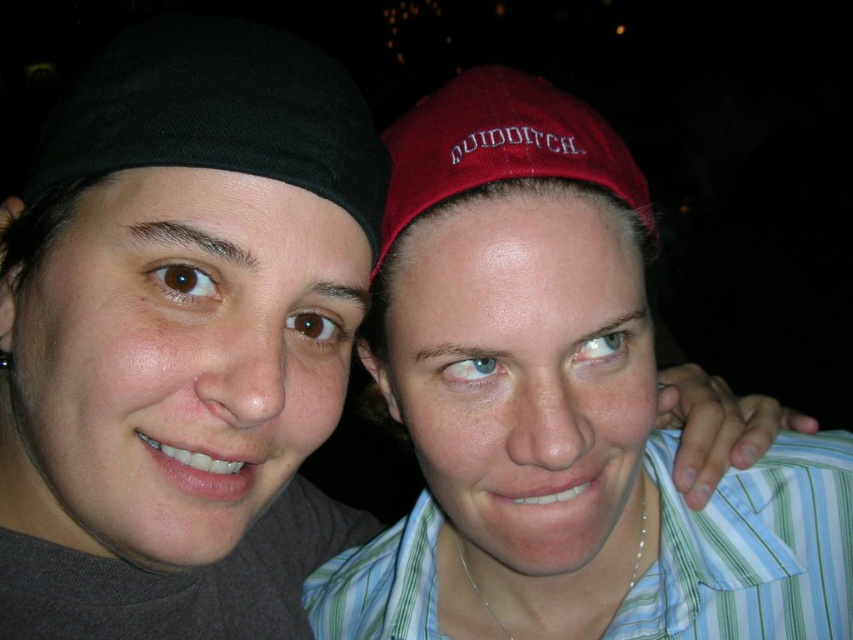
Question: Which point is closer to the camera?

Choices:
 (A) matte red cap at upper right
 (B) black fabric headband at left

Answer: (B)

Question: Which point is farther from the camera taking this photo?

Choices:
 (A) (317, 147)
 (B) (468, 365)
 (C) (556, 150)

Answer: (B)

Question: Is black fabric headband at left bigger than burgundy fabric cap at upper center?

Choices:
 (A) yes
 (B) no

Answer: (A)

Question: Can you confirm if matte red cap at upper right is thinner than black fabric headband at left?

Choices:
 (A) yes
 (B) no

Answer: (B)

Question: Does matte red cap at upper right have a lesser width compared to burgundy fabric cap at upper center?

Choices:
 (A) no
 (B) yes

Answer: (A)

Question: Which of the following is the farthest from the observer?

Choices:
 (A) matte red cap at upper right
 (B) black fabric headband at left
 (C) burgundy fabric cap at upper center

Answer: (C)